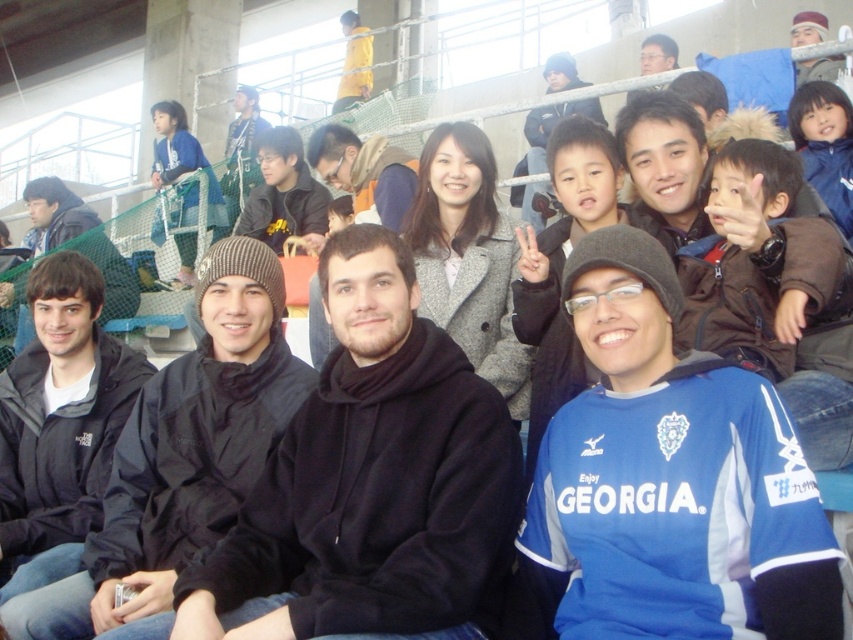
You are standing in the stadium and want to take a photo of two specific points in the image. The first point is at coordinate point(750,499) and the second is at point(155,547). Which point is closer to you?

Point(750,499) is closer to the camera than point(155,547).

You are a photographer trying to capture a closeup of the blue jersey at center and the black matte jacket at center. Which one would you need to zoom in more on?

The blue jersey at center is smaller than the black matte jacket at center, so you would need to zoom in more on the blue jersey at center to capture it clearly.